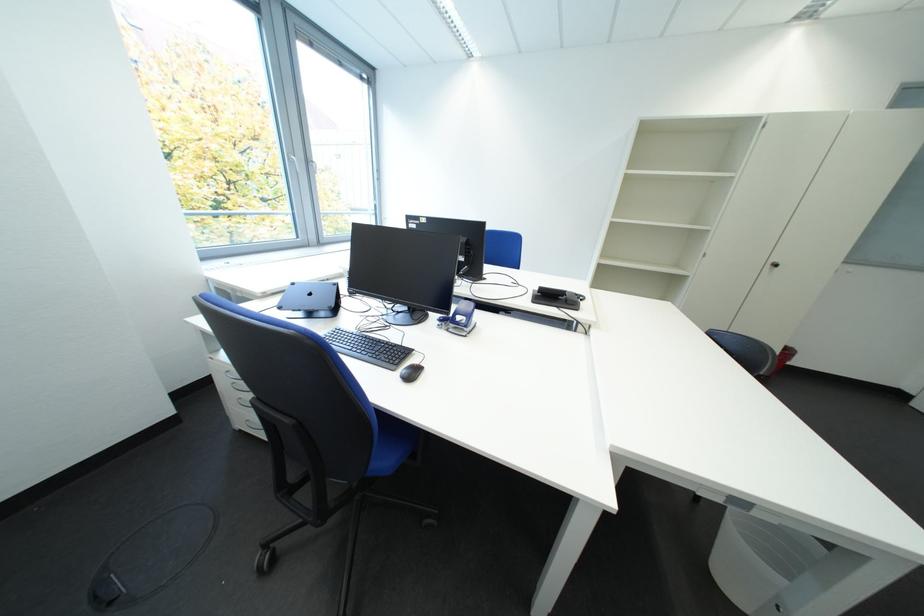
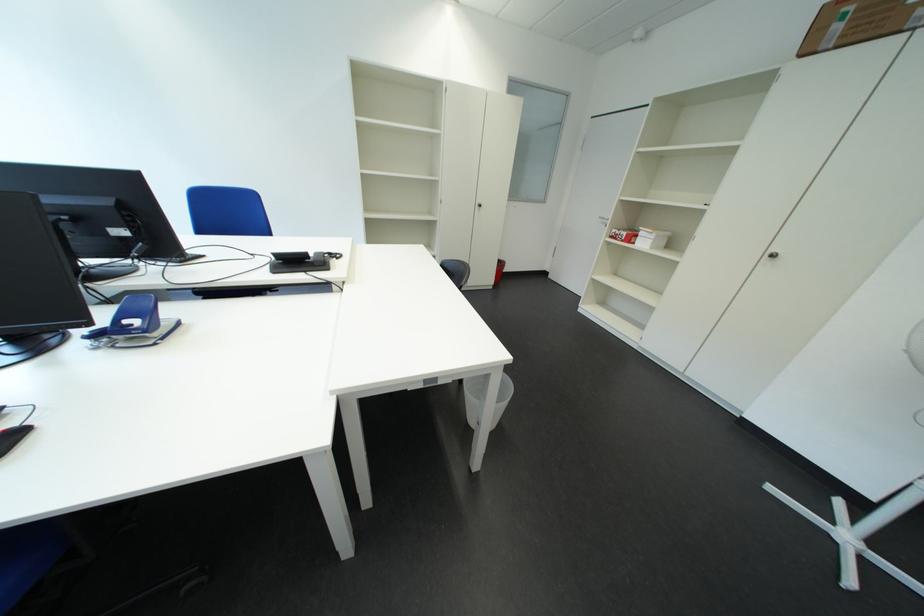
The point at (451, 325) is marked in the first image. Where is the corresponding point in the second image?

(101, 344)